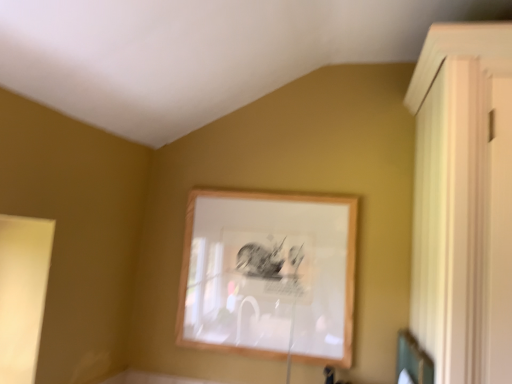
What do you see at coordinates (269, 275) in the screenshot? I see `wooden picture frame at center` at bounding box center [269, 275].

At what (x,y) coordinates should I click in order to perform the action: click on wooden picture frame at center. Please return your answer as a coordinate pair (x, y). The width and height of the screenshot is (512, 384). Looking at the image, I should click on (269, 275).

Locate an element on the screen. The height and width of the screenshot is (384, 512). wooden picture frame at center is located at coordinates (269, 275).